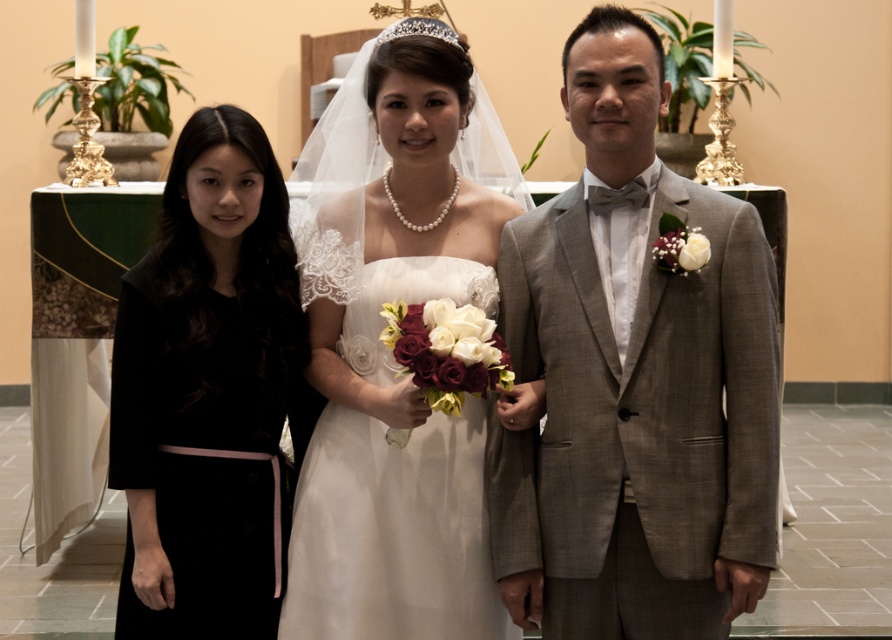
Question: Which of the following is the closest to the observer?

Choices:
 (A) tap(395, 150)
 (B) tap(196, 612)

Answer: (B)

Question: Which object appears farthest from the camera in this image?

Choices:
 (A) white satin dress at center
 (B) gray textured suit at right
 (C) black satin dress at left
 (D) silver metallic tiara at center

Answer: (D)

Question: Can you confirm if gray textured suit at right is thinner than white satin dress at center?

Choices:
 (A) yes
 (B) no

Answer: (A)

Question: Is black satin dress at left to the left of silver metallic tiara at center from the viewer's perspective?

Choices:
 (A) no
 (B) yes

Answer: (B)

Question: Can you confirm if white satin dress at center is positioned above black satin dress at left?

Choices:
 (A) yes
 (B) no

Answer: (A)

Question: Among these points, which one is farthest from the camera?

Choices:
 (A) (303, 499)
 (B) (645, 618)
 (C) (147, 369)
 (D) (395, 35)

Answer: (A)